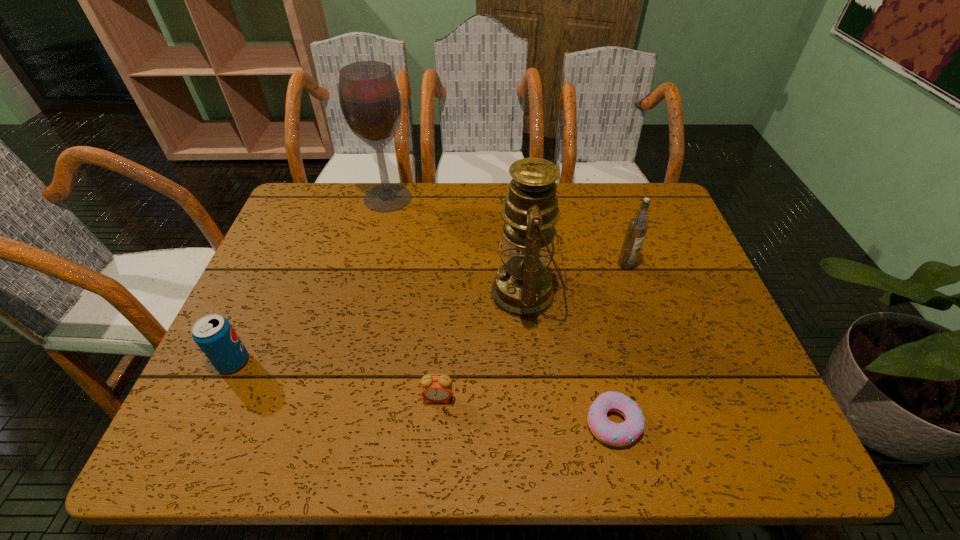
Find the location of a particular element. object at the right edge is located at coordinates click(637, 228).

Locate an element on the screen. This screenshot has height=540, width=960. free space at the far edge of the desktop is located at coordinates (490, 211).

You are a GUI agent. You are given a task and a screenshot of the screen. Output one action in this format:
    pyautogui.click(x=<x>, y=<y>)
    Task: Click on the free point at the left edge
    The height and width of the screenshot is (540, 960).
    Given the screenshot: What is the action you would take?
    pyautogui.click(x=258, y=307)

This screenshot has width=960, height=540. In the image, there is a desktop. In order to click on vacant space at the right edge in this screenshot , I will do `click(699, 334)`.

Identify the location of vacant space at the far left corner of the desktop. The width and height of the screenshot is (960, 540). (350, 183).

In order to click on free space at the far right corner in this screenshot , I will do `click(654, 222)`.

You are a GUI agent. You are given a task and a screenshot of the screen. Output one action in this format:
    pyautogui.click(x=<x>, y=<y>)
    Task: Click on the empty space between the alarm clock and the fourth object from left to right
    This screenshot has width=960, height=540.
    Given the screenshot: What is the action you would take?
    pyautogui.click(x=482, y=346)

This screenshot has width=960, height=540. Identify the location of empty space that is in between the alcohol and the fifth tallest object. (413, 298).

Image resolution: width=960 pixels, height=540 pixels. Find the location of `vacant space that is in between the soda can and the third object from left to right`. vacant space that is in between the soda can and the third object from left to right is located at coordinates [x=336, y=380].

Locate an element on the screen. This screenshot has height=540, width=960. free spot between the third object from left to right and the oil lamp is located at coordinates (482, 346).